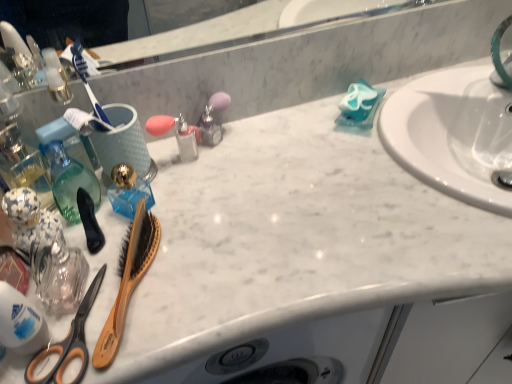
Where is `vacant space to the right of translucent purple bottle at center`? vacant space to the right of translucent purple bottle at center is located at coordinates (295, 142).